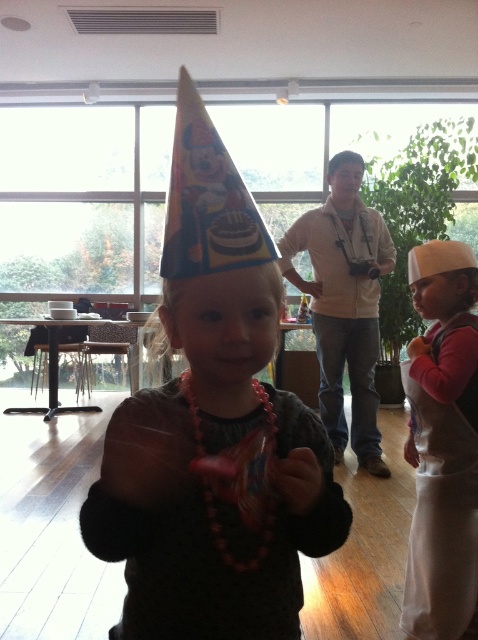
Question: Is matte party hat at center below white fabric apron at lower right?

Choices:
 (A) yes
 (B) no

Answer: (B)

Question: Is matte party hat at center wider than white fabric apron at lower right?

Choices:
 (A) yes
 (B) no

Answer: (A)

Question: Does matte party hat at center have a larger size compared to white fabric apron at lower right?

Choices:
 (A) yes
 (B) no

Answer: (B)

Question: Among these objects, which one is farthest from the camera?

Choices:
 (A) white fabric apron at lower right
 (B) matte party hat at center

Answer: (A)